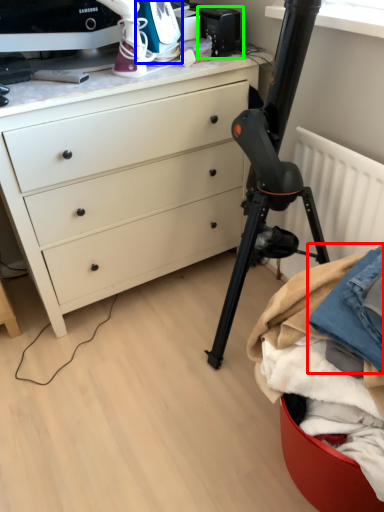
Question: Estimate the real-world distances between objects in this image. Which object is farther from clothing (highlighted by a red box), appliance (highlighted by a blue box) or appliance (highlighted by a green box)?

Choices:
 (A) appliance
 (B) appliance

Answer: (B)